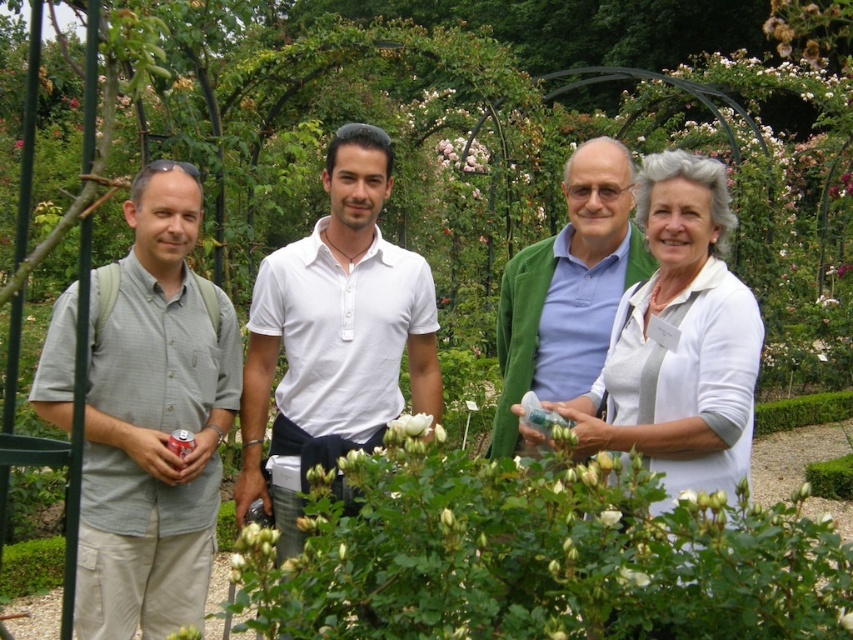
Is white matte jacket at center positioned behind blue cotton shirt at center?

No, white matte jacket at center is closer to the viewer.

Does white matte jacket at center have a greater height compared to blue cotton shirt at center?

In fact, white matte jacket at center may be shorter than blue cotton shirt at center.

Is point (654, 445) farther from viewer compared to point (599, 330)?

No, it is not.

The width and height of the screenshot is (853, 640). I want to click on white matte jacket at center, so click(677, 340).

Is blue cotton shirt at center closer to camera compared to white matte flower at center?

No, it is not.

Who is positioned more to the left, blue cotton shirt at center or white matte flower at center?

From the viewer's perspective, white matte flower at center appears more on the left side.

At what (x,y) coordinates should I click in order to perform the action: click on blue cotton shirt at center. Please return your answer as a coordinate pair (x, y). The image size is (853, 640). Looking at the image, I should click on (567, 289).

Looking at this image, between white cotton polo shirt at center and blue cotton shirt at center, which one has less height?

Standing shorter between the two is blue cotton shirt at center.

Does point (262, 497) lie in front of point (538, 376)?

No, it is not.

You are a GUI agent. You are given a task and a screenshot of the screen. Output one action in this format:
    pyautogui.click(x=<x>, y=<y>)
    Task: Click on the white cotton polo shirt at center
    Image resolution: width=853 pixels, height=640 pixels.
    Given the screenshot: What is the action you would take?
    pyautogui.click(x=334, y=337)